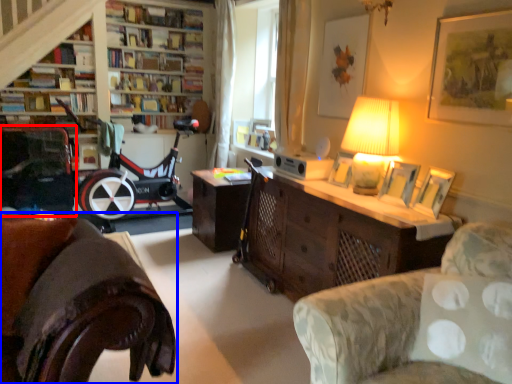
Question: Which object appears farthest to the camera in this image, armchair (highlighted by a red box) or studio couch (highlighted by a blue box)?

Choices:
 (A) armchair
 (B) studio couch

Answer: (A)